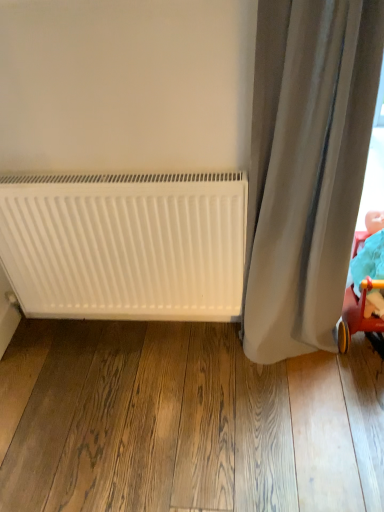
Question: Can you confirm if white matte radiator at lower left is shorter than gray fabric curtain at right?

Choices:
 (A) yes
 (B) no

Answer: (A)

Question: Does white matte radiator at lower left lie in front of gray fabric curtain at right?

Choices:
 (A) yes
 (B) no

Answer: (B)

Question: Is white matte radiator at lower left bigger than gray fabric curtain at right?

Choices:
 (A) yes
 (B) no

Answer: (B)

Question: Considering the relative sizes of white matte radiator at lower left and gray fabric curtain at right in the image provided, is white matte radiator at lower left smaller than gray fabric curtain at right?

Choices:
 (A) no
 (B) yes

Answer: (B)

Question: From the image's perspective, is white matte radiator at lower left on gray fabric curtain at right?

Choices:
 (A) yes
 (B) no

Answer: (B)

Question: Are white matte radiator at lower left and gray fabric curtain at right located far from each other?

Choices:
 (A) no
 (B) yes

Answer: (A)

Question: Does matte red plastic baby carriage at lower right have a greater width compared to gray fabric curtain at right?

Choices:
 (A) yes
 (B) no

Answer: (A)

Question: Does matte red plastic baby carriage at lower right have a larger size compared to gray fabric curtain at right?

Choices:
 (A) no
 (B) yes

Answer: (A)

Question: Is matte red plastic baby carriage at lower right behind gray fabric curtain at right?

Choices:
 (A) yes
 (B) no

Answer: (A)

Question: Considering the relative positions of matte red plastic baby carriage at lower right and gray fabric curtain at right in the image provided, is matte red plastic baby carriage at lower right to the right of gray fabric curtain at right from the viewer's perspective?

Choices:
 (A) yes
 (B) no

Answer: (A)

Question: From the image's perspective, is matte red plastic baby carriage at lower right under gray fabric curtain at right?

Choices:
 (A) no
 (B) yes

Answer: (B)

Question: Is matte red plastic baby carriage at lower right aimed at gray fabric curtain at right?

Choices:
 (A) no
 (B) yes

Answer: (A)

Question: Is gray fabric curtain at right positioned beyond the bounds of white matte radiator at lower left?

Choices:
 (A) no
 (B) yes

Answer: (B)